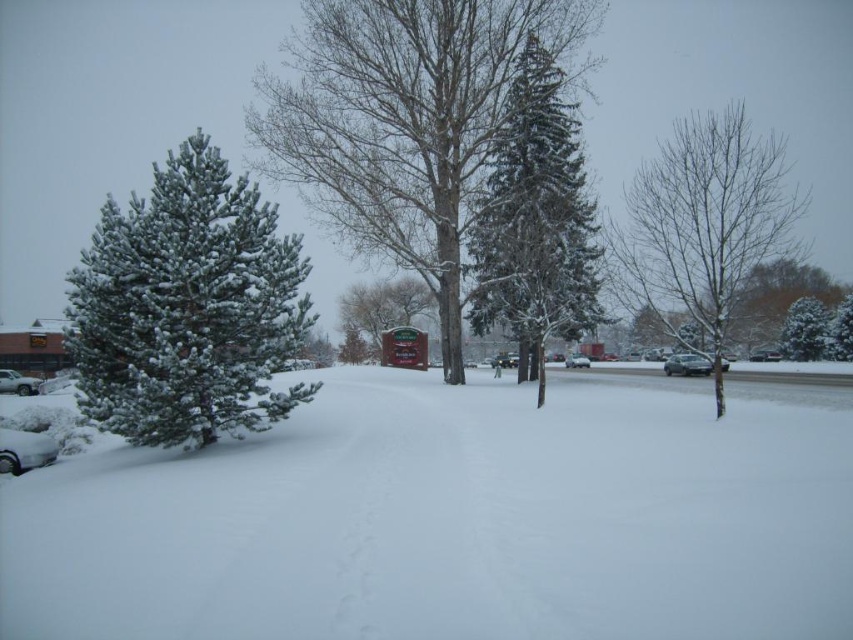
You are standing at the point marked by the coordinates point (535, 221). Looking around, you see a snow covered evergreen tree at center. Which direction should you walk to reach the small evergreen tree on the left side?

The point (535, 221) is at the snow covered evergreen tree at center. To reach the small evergreen tree on the left side, you should walk to the left.